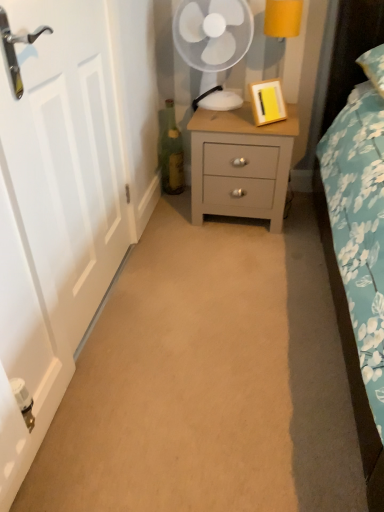
Locate an element on the screen. The height and width of the screenshot is (512, 384). vacant area that lies between matte gray nightstand at center and white matte door at left is located at coordinates (183, 258).